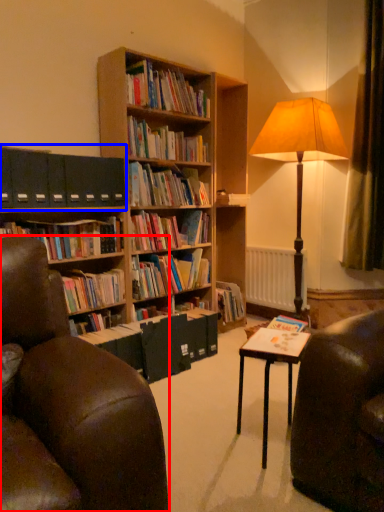
Question: Which object appears closest to the camera in this image, chair (highlighted by a red box) or shelf (highlighted by a blue box)?

Choices:
 (A) chair
 (B) shelf

Answer: (A)